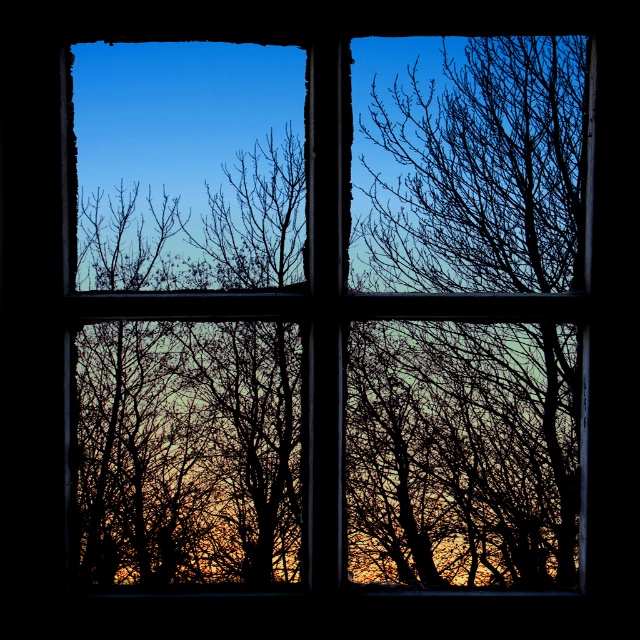
Question: Which object appears closest to the camera in this image?

Choices:
 (A) silhouette bare tree at right
 (B) transparent glass window at center

Answer: (A)

Question: Where is transparent glass window at center located in relation to silhouette bare tree at right in the image?

Choices:
 (A) right
 (B) left

Answer: (B)

Question: Considering the relative positions of transparent glass window at center and silhouette bare tree at right in the image provided, where is transparent glass window at center located with respect to silhouette bare tree at right?

Choices:
 (A) below
 (B) above

Answer: (A)

Question: Which point is closer to the camera?

Choices:
 (A) (472, 76)
 (B) (460, 528)

Answer: (A)

Question: Among these points, which one is nearest to the camera?

Choices:
 (A) (504, 554)
 (B) (499, 547)

Answer: (A)

Question: Is transparent glass window at center to the left of silhouette bare tree at right from the viewer's perspective?

Choices:
 (A) yes
 (B) no

Answer: (A)